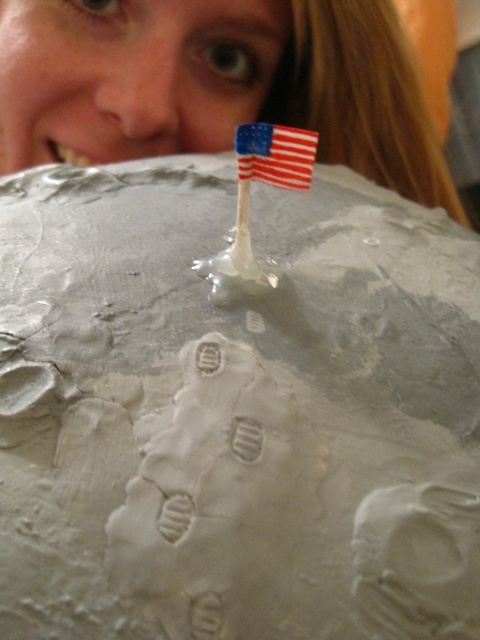
This screenshot has width=480, height=640. What are the coordinates of `matte skin at upper center` in the screenshot? It's located at 132,76.

Does matte skin at upper center appear on the left side of american flag at center?

Indeed, matte skin at upper center is positioned on the left side of american flag at center.

Is point (67, 102) positioned before point (285, 145)?

No, it is behind (285, 145).

This screenshot has height=640, width=480. I want to click on matte skin at upper center, so click(x=132, y=76).